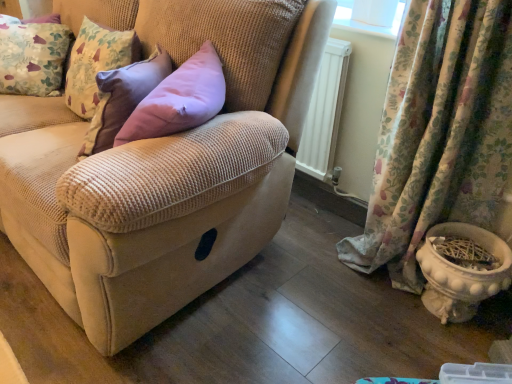
Question: Considering the relative sizes of white glossy flowerpot at lower right and floral fabric curtain at lower right in the image provided, is white glossy flowerpot at lower right bigger than floral fabric curtain at lower right?

Choices:
 (A) yes
 (B) no

Answer: (B)

Question: From the image's perspective, is white glossy flowerpot at lower right on floral fabric curtain at lower right?

Choices:
 (A) yes
 (B) no

Answer: (B)

Question: Are white glossy flowerpot at lower right and floral fabric curtain at lower right beside each other?

Choices:
 (A) no
 (B) yes

Answer: (A)

Question: Is white glossy flowerpot at lower right turned away from floral fabric curtain at lower right?

Choices:
 (A) yes
 (B) no

Answer: (A)

Question: Considering the relative sizes of white glossy flowerpot at lower right and floral fabric curtain at lower right in the image provided, is white glossy flowerpot at lower right taller than floral fabric curtain at lower right?

Choices:
 (A) yes
 (B) no

Answer: (B)

Question: Can you confirm if white glossy flowerpot at lower right is positioned to the right of floral fabric curtain at lower right?

Choices:
 (A) no
 (B) yes

Answer: (B)

Question: Considering the relative sizes of white glossy flowerpot at lower right and beige corduroy couch at center in the image provided, is white glossy flowerpot at lower right shorter than beige corduroy couch at center?

Choices:
 (A) yes
 (B) no

Answer: (A)

Question: From the image's perspective, is white glossy flowerpot at lower right under beige corduroy couch at center?

Choices:
 (A) yes
 (B) no

Answer: (A)

Question: Is white glossy flowerpot at lower right smaller than beige corduroy couch at center?

Choices:
 (A) no
 (B) yes

Answer: (B)

Question: Is white glossy flowerpot at lower right oriented towards beige corduroy couch at center?

Choices:
 (A) yes
 (B) no

Answer: (B)

Question: Is white glossy flowerpot at lower right outside of beige corduroy couch at center?

Choices:
 (A) no
 (B) yes

Answer: (B)

Question: Considering the relative sizes of white glossy flowerpot at lower right and beige corduroy couch at center in the image provided, is white glossy flowerpot at lower right bigger than beige corduroy couch at center?

Choices:
 (A) yes
 (B) no

Answer: (B)

Question: Is floral fabric cushion at upper left positioned before white glossy flowerpot at lower right?

Choices:
 (A) yes
 (B) no

Answer: (B)